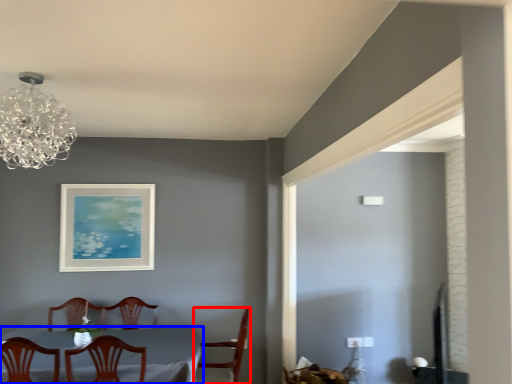
Question: Which object appears closest to the camera in this image, chair (highlighted by a red box) or table (highlighted by a blue box)?

Choices:
 (A) chair
 (B) table

Answer: (B)